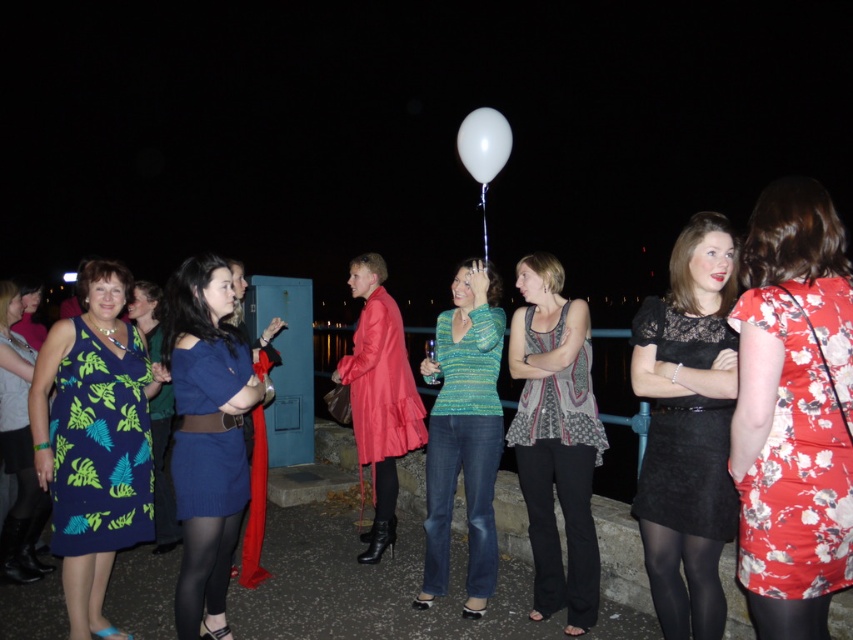
Question: Which object is positioned closest to the green leafy fabric dress at left?

Choices:
 (A) denim jeans at center
 (B) floral dress at center
 (C) black sheer tights at lower right

Answer: (A)

Question: Which of the following is the farthest from the observer?

Choices:
 (A) denim jeans at center
 (B) floral dress at center

Answer: (A)

Question: Is black lace dress at center bigger than black sheer tights at lower left?

Choices:
 (A) yes
 (B) no

Answer: (A)

Question: Which of the following is the farthest from the observer?

Choices:
 (A) (219, 438)
 (B) (428, 445)
 (C) (78, 497)

Answer: (B)

Question: Does black cotton pants at center come in front of green leafy dress at left?

Choices:
 (A) no
 (B) yes

Answer: (B)

Question: Does knitted green sweater at center appear on the left side of black sheer tights at lower right?

Choices:
 (A) yes
 (B) no

Answer: (A)